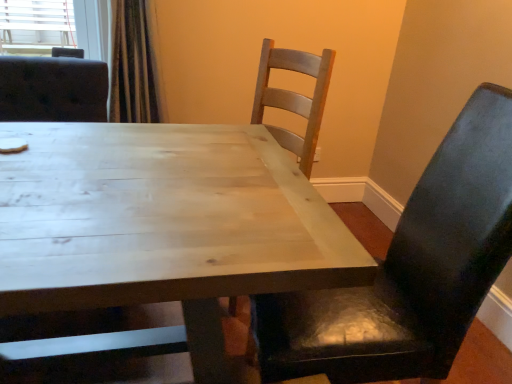
Measure the distance between matte black chair at right and camera.

35.40 inches.

What do you see at coordinates (410, 269) in the screenshot? The width and height of the screenshot is (512, 384). I see `matte black chair at right` at bounding box center [410, 269].

The height and width of the screenshot is (384, 512). Identify the location of matte black chair at right. (410, 269).

Find the location of `light wood table at center`. light wood table at center is located at coordinates (160, 230).

The image size is (512, 384). Describe the element at coordinates (160, 230) in the screenshot. I see `light wood table at center` at that location.

Find the location of `matte black chair at right`. matte black chair at right is located at coordinates (410, 269).

Which object is positioned more to the right, light wood table at center or matte black chair at right?

From the viewer's perspective, matte black chair at right appears more on the right side.

Is the depth of light wood table at center greater than that of matte black chair at right?

No.

Which is further, (98, 224) or (468, 182)?

The point (468, 182) is behind.

From the image's perspective, is light wood table at center above matte black chair at right?

No, from the image's perspective, light wood table at center is not above matte black chair at right.

From a real-world perspective, which is physically below, light wood table at center or matte black chair at right?

light wood table at center.

Between light wood table at center and matte black chair at right, which one has larger width?

With larger width is light wood table at center.

Is light wood table at center taller than matte black chair at right?

No.

Who is smaller, light wood table at center or matte black chair at right?

matte black chair at right is smaller.

Is matte black chair at right inside light wood table at center?

That's incorrect, matte black chair at right is not inside light wood table at center.

Looking at this image, would you consider light wood table at center to be distant from matte black chair at right?

light wood table at center is actually quite close to matte black chair at right.

Could you tell me if light wood table at center is turned towards matte black chair at right?

No, light wood table at center is not turned towards matte black chair at right.

From the picture: What's the angular difference between light wood table at center and matte black chair at right's facing directions?

The angle between the facing direction of light wood table at center and the facing direction of matte black chair at right is 91.9 degrees.

How distant is light wood table at center from matte black chair at right?

light wood table at center is 39.73 centimeters away from matte black chair at right.

I want to click on table in front of the matte black chair at right, so click(x=160, y=230).

Which is more to the right, matte black chair at right or light wood table at center?

matte black chair at right.

Which object is further away from the camera taking this photo, matte black chair at right or light wood table at center?

matte black chair at right is behind.

Considering the points (279, 302) and (111, 152), which point is behind, point (279, 302) or point (111, 152)?

The point (111, 152) is farther from the camera.

From the image's perspective, is matte black chair at right located above light wood table at center?

Yes.

From the picture: From a real-world perspective, is matte black chair at right physically below light wood table at center?

No, from a real-world perspective, matte black chair at right is not beneath light wood table at center.

Consider the image. Between matte black chair at right and light wood table at center, which one has larger width?

light wood table at center is wider.

In the scene shown: Does matte black chair at right have a lesser height compared to light wood table at center?

In fact, matte black chair at right may be taller than light wood table at center.

Is matte black chair at right smaller than light wood table at center?

Yes, matte black chair at right is smaller than light wood table at center.

Consider the image. Would you say light wood table at center is part of matte black chair at right's contents?

No, light wood table at center is not surrounded by matte black chair at right.

Is there a large distance between matte black chair at right and light wood table at center?

No, there isn't a large distance between matte black chair at right and light wood table at center.

Is matte black chair at right aimed at light wood table at center?

Yes.

What's the angular difference between matte black chair at right and light wood table at center's facing directions?

There is a 91.9-degree angle between the facing directions of matte black chair at right and light wood table at center.

How far apart are matte black chair at right and light wood table at center?

39.73 centimeters.

At what (x,y) coordinates should I click in order to perform the action: click on table located underneath the matte black chair at right (from a real-world perspective). Please return your answer as a coordinate pair (x, y). Looking at the image, I should click on (160, 230).

This screenshot has width=512, height=384. I want to click on table beneath the matte black chair at right (from a real-world perspective), so point(160,230).

Locate an element on the screen. chair on the right of light wood table at center is located at coordinates click(x=410, y=269).